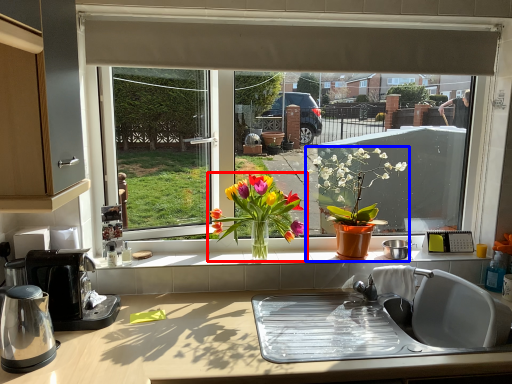
Question: Which object is further to the camera taking this photo, houseplant (highlighted by a red box) or houseplant (highlighted by a blue box)?

Choices:
 (A) houseplant
 (B) houseplant

Answer: (B)